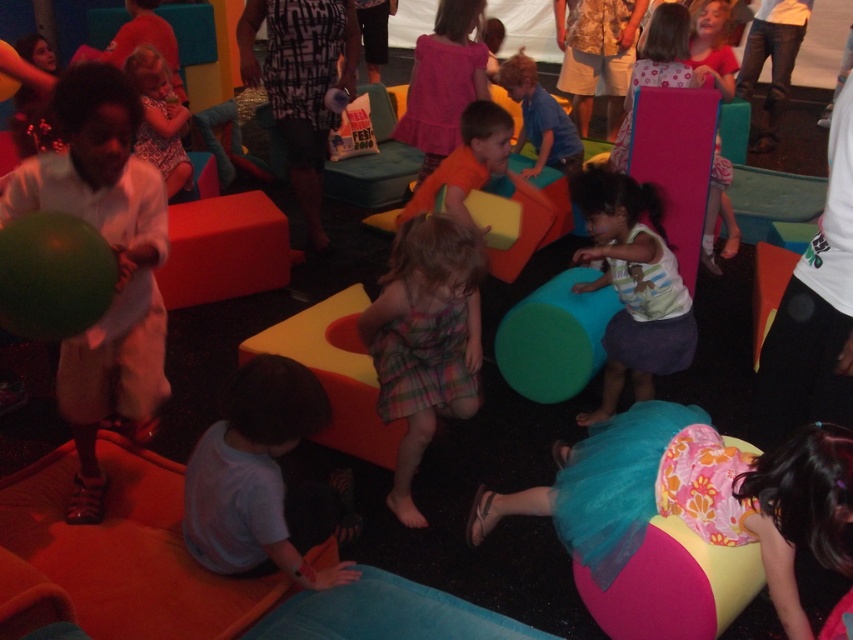
Question: Can you confirm if floral fabric dress at lower right is wider than green rubber ball at left?

Choices:
 (A) yes
 (B) no

Answer: (A)

Question: Among these points, which one is farthest from the camera?

Choices:
 (A) (151, 109)
 (B) (822, 563)
 (C) (595, 292)
 (D) (300, 483)

Answer: (A)

Question: Among these objects, which one is farthest from the camera?

Choices:
 (A) green rubber ball at left
 (B) orange matte shirt at center
 (C) white striped shirt at center
 (D) matte floral dress at upper left

Answer: (D)

Question: Does plaid fabric dress at center appear on the right side of matte floral dress at upper left?

Choices:
 (A) yes
 (B) no

Answer: (A)

Question: Which point is closer to the camera?

Choices:
 (A) (79, 124)
 (B) (627, 308)
 (C) (467, 266)

Answer: (A)

Question: Is floral fabric dress at lower right below white striped shirt at center?

Choices:
 (A) yes
 (B) no

Answer: (A)